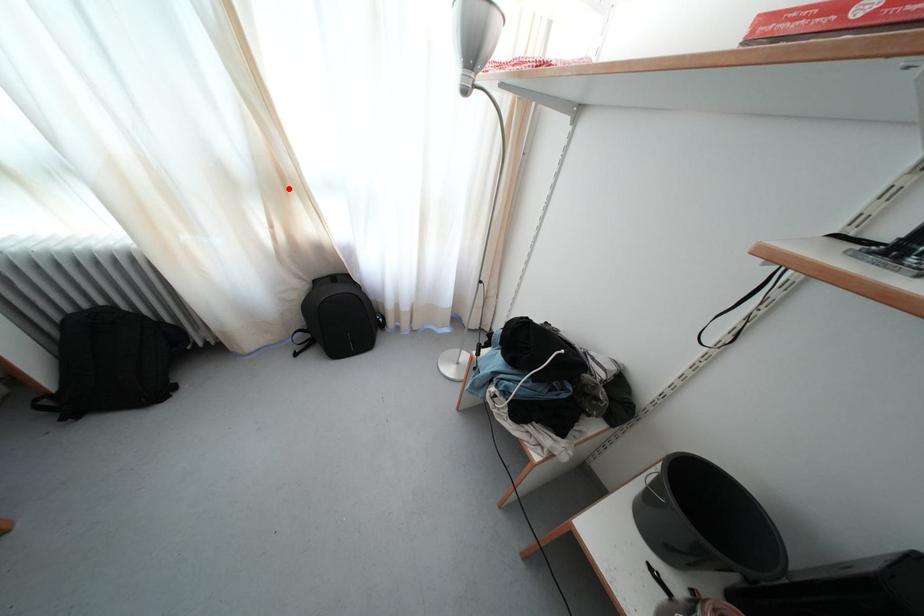
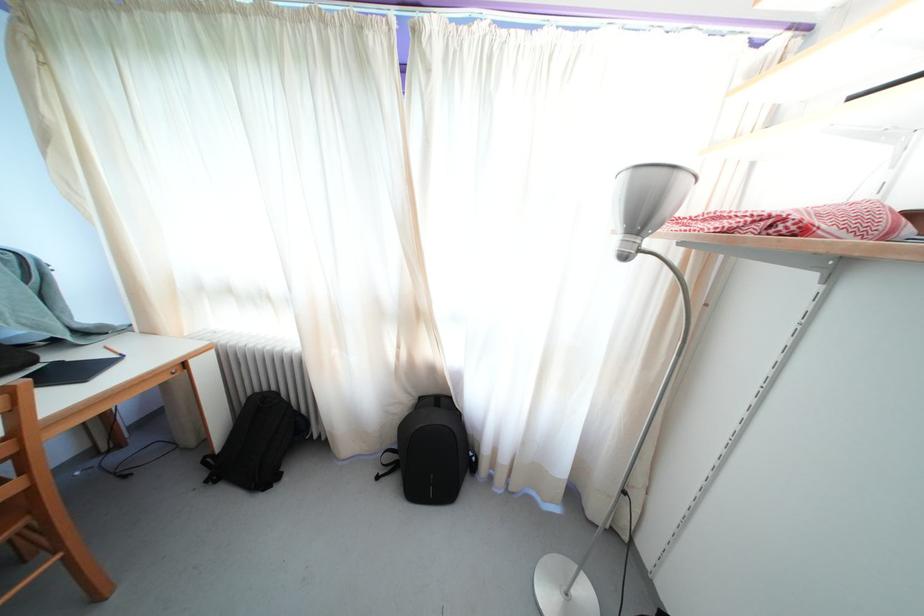
Question: I am providing you with two images of the same scene from different viewpoints. Given a red point in image1, look at the same physical point in image2. Is it:

Choices:
 (A) Closer to the viewpoint
 (B) Farther from the viewpoint

Answer: (B)